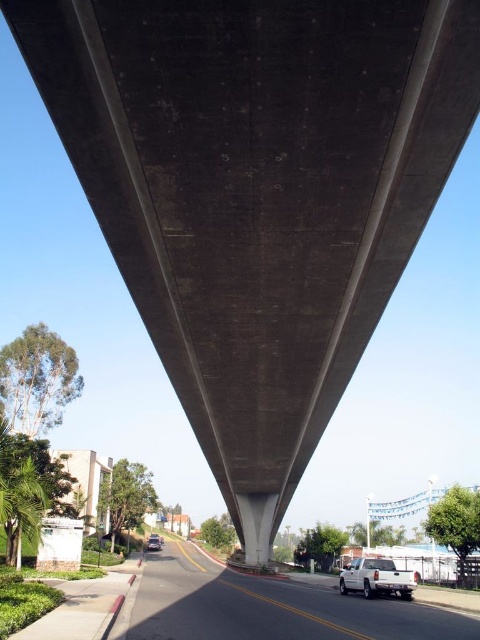
Is white matte truck at lower right thinner than metallic silver car at lower center?

In fact, white matte truck at lower right might be wider than metallic silver car at lower center.

Is white matte truck at lower right to the right of metallic silver car at lower center from the viewer's perspective?

Indeed, white matte truck at lower right is positioned on the right side of metallic silver car at lower center.

Where is `white matte truck at lower right`? Image resolution: width=480 pixels, height=640 pixels. white matte truck at lower right is located at coordinates (376, 579).

Is point (420, 611) positioned before point (384, 560)?

Yes, it is.

Is white glossy truck at lower center above white matte truck at lower right?

No.

Is point (191, 637) less distant than point (360, 589)?

Yes, it is in front of point (360, 589).

What are the coordinates of `white glossy truck at lower center` in the screenshot? It's located at pyautogui.click(x=264, y=605).

Can you confirm if white glossy truck at lower center is smaller than metallic silver car at lower center?

No, white glossy truck at lower center is not smaller than metallic silver car at lower center.

Which is more to the left, white glossy truck at lower center or metallic silver car at lower center?

metallic silver car at lower center

Find the location of a particular element. white glossy truck at lower center is located at coordinates (264, 605).

Identify the location of white glossy truck at lower center. This screenshot has width=480, height=640. (264, 605).